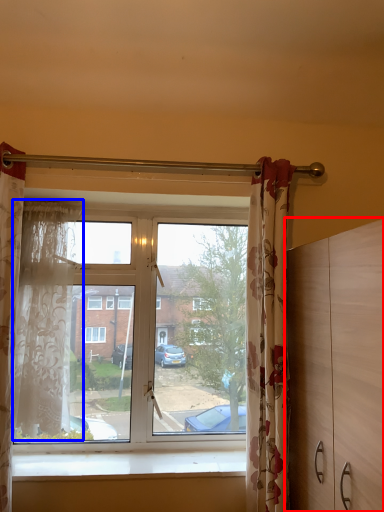
Question: Which of the following is the farthest to the observer, dresser (highlighted by a red box) or curtain (highlighted by a blue box)?

Choices:
 (A) dresser
 (B) curtain

Answer: (B)